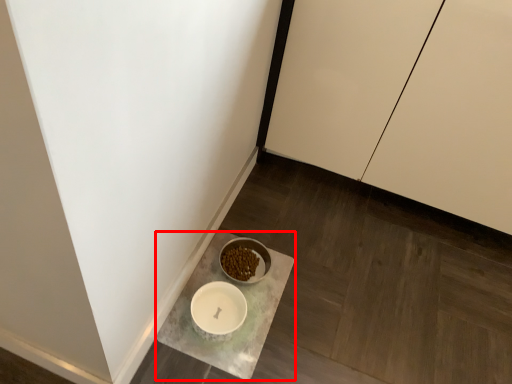
Question: From the image's perspective, considering the relative positions of counter (annotated by the red box) and cabinetry in the image provided, where is counter (annotated by the red box) located with respect to the staircase?

Choices:
 (A) below
 (B) above

Answer: (A)